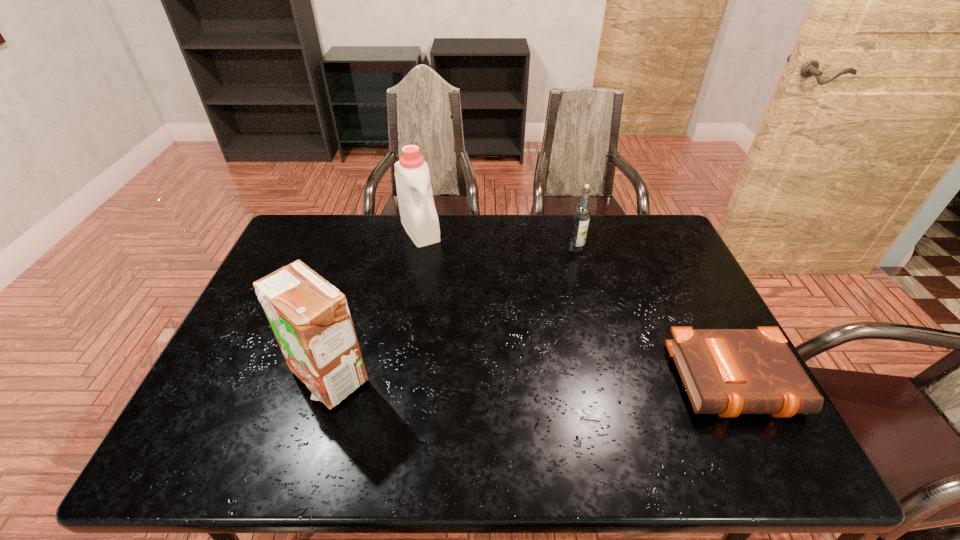
Locate an element on the screen. Image resolution: width=960 pixels, height=540 pixels. free space located on the label of the third object from left to right is located at coordinates (581, 282).

At what (x,y) coordinates should I click in order to perform the action: click on free location located on the label of the third object from left to right. Please return your answer as a coordinate pair (x, y). The image size is (960, 540). Looking at the image, I should click on (584, 306).

Find the location of a particular element. The height and width of the screenshot is (540, 960). detergent situated at the far edge is located at coordinates (419, 218).

Where is `vodka that is at the far edge`? vodka that is at the far edge is located at coordinates (581, 216).

Locate an element on the screen. The width and height of the screenshot is (960, 540). carton that is at the near edge is located at coordinates (310, 319).

Where is `Bible located in the near edge section of the desktop`? Bible located in the near edge section of the desktop is located at coordinates (728, 372).

You are a GUI agent. You are given a task and a screenshot of the screen. Output one action in this format:
    pyautogui.click(x=<x>, y=<y>)
    Task: Click on the object at the right edge
    
    Given the screenshot: What is the action you would take?
    coord(728,372)

This screenshot has height=540, width=960. I want to click on object located at the near right corner, so [728, 372].

Find the location of a particular element. This screenshot has width=960, height=540. vacant region at the far edge of the desktop is located at coordinates (343, 235).

Where is `vacant area at the near edge`? The height and width of the screenshot is (540, 960). vacant area at the near edge is located at coordinates (492, 409).